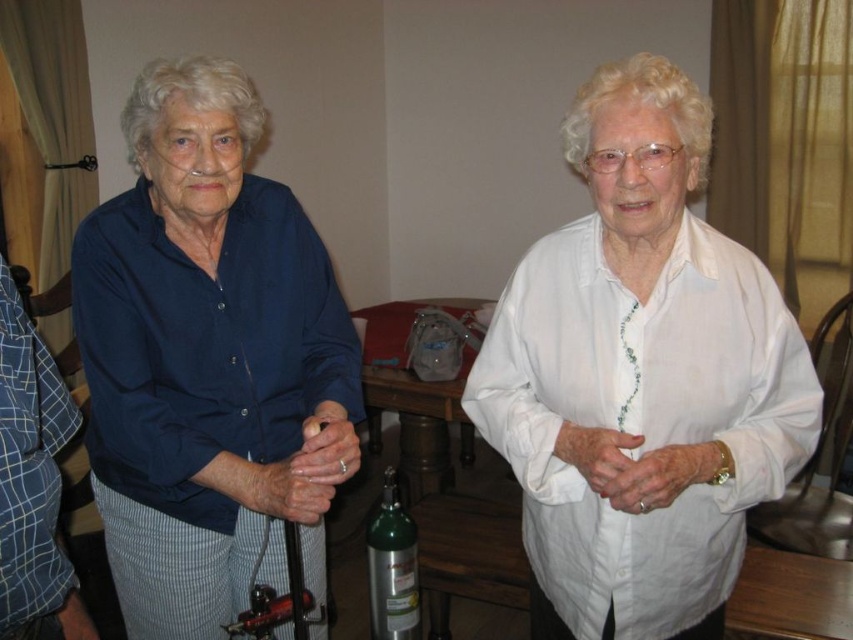
You are a fashion designer observing the scene. You need to determine if the matte blue shirt at left can be folded to fit into the silver metallic oxygen tank at center. Based on their sizes, what do you think?

The matte blue shirt at left is wider than the silver metallic oxygen tank at center, so it might not fit inside unless folded carefully. However, the tank might be too narrow to accommodate the shirt even when folded.

You are a healthcare professional assessing the spatial arrangement of items in the room. The white cotton shirt at upper right and the silver metallic oxygen tank at center are both visible in your line of sight. Which object is positioned higher in the image?

The white cotton shirt at upper right is taller than the silver metallic oxygen tank at center, so it is positioned higher in the image.

From the picture: You are a photographer setting up for a portrait session. You need to position a light source to the left of the matte blue shirt at left and to the right of the white cotton shirt at upper right. Is this possible given their positions?

The white cotton shirt at upper right is to the right of the matte blue shirt at left, so placing a light source to the left of the matte blue shirt at left would also be to the left of the white cotton shirt at upper right. Therefore, it is not possible to position the light source both to the left of the matte blue shirt at left and to the right of the white cotton shirt at upper right as their positions make this arrangement impossible.